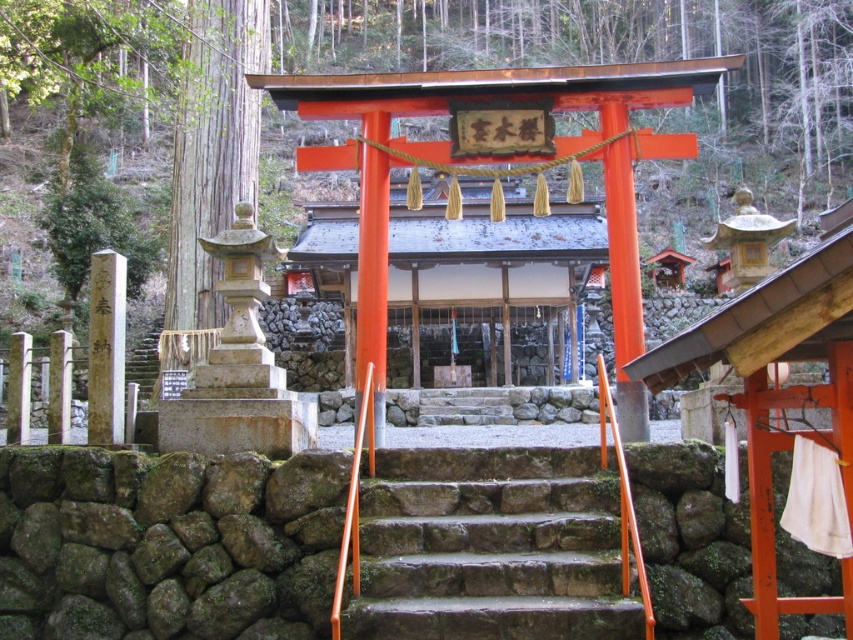
You are a visitor at the shrine and want to walk up the mossy stone stairs at center. Before starting, you notice the orange glossy torii gate at center. Which one is wider in terms of their widths?

The mossy stone stairs at center is wider than the orange glossy torii gate at center according to the description.

You are standing at the entrance of the traditional Japanese shrine and want to reach the torii gate. Which direction should you move relative to the mossy stone stairs at center?

The mossy stone stairs at center are located at point (490, 547), which is towards the center of the image. Since the torii gate is the main entrance, you should move towards the mossy stone stairs at center to reach the torii gate.

Consider the image. You are standing at the entrance of the shrine and want to take a photo of the orange glossy torii gate at center and the brown stone pillar at left. Which object should you focus on first to ensure both are in the frame?

You should focus on the orange glossy torii gate at center first because it is in front of the brown stone pillar at left, so it will naturally be in the foreground while the pillar remains visible in the background.